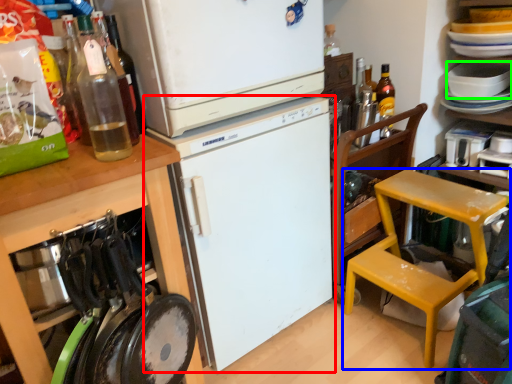
Question: Which is nearer to the refrigerator (highlighted by a red box)? chair (highlighted by a blue box) or appliance (highlighted by a green box).

Choices:
 (A) chair
 (B) appliance

Answer: (A)